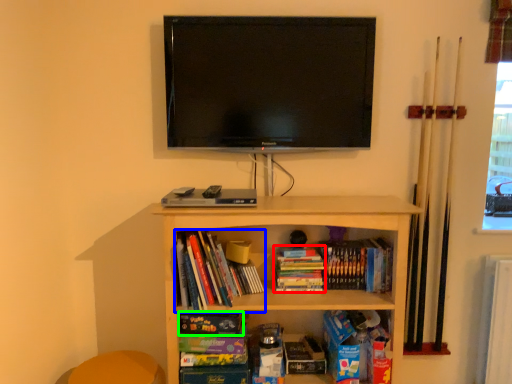
Question: Based on their relative distances, which object is nearer to book (highlighted by a red box)? Choose from book (highlighted by a blue box) and paperback book (highlighted by a green box).

Choices:
 (A) book
 (B) paperback book

Answer: (A)